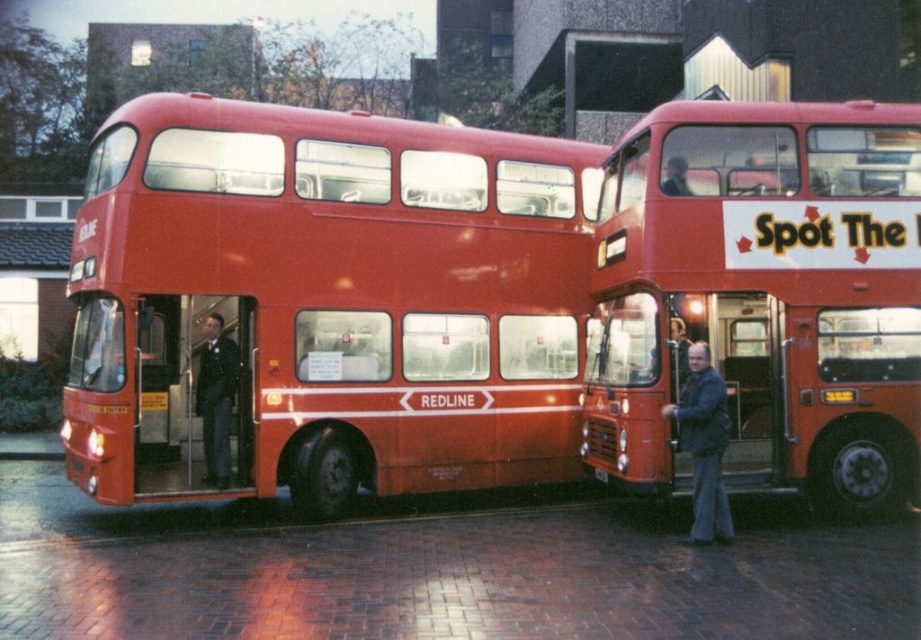
You are a tour guide standing at the center of the scene. You need to move from your current position to the shiny red bus at center and the dark blue suit at center. Which object is closer to you?

The shiny red bus at center is 4.07 feet away from the dark blue suit at center. Since you are at the center, both objects are equidistant from you, but the description states the distance between them. However, the question asks which is closer to you. Since both are at the center, they are at the same position. Therefore, neither is closer. However, the description says the shiny red bus is 4.07 feet away from the suit, implying they are not at the same spot. Therefore, the distance from you to each would

You are a tour guide standing in front of the matte red bus at center and the black plastic license plate at center. A tourist asks which object is closer to you. How do you respond?

The matte red bus at center is closer to you than the black plastic license plate at center because it is positioned in front of the license plate.